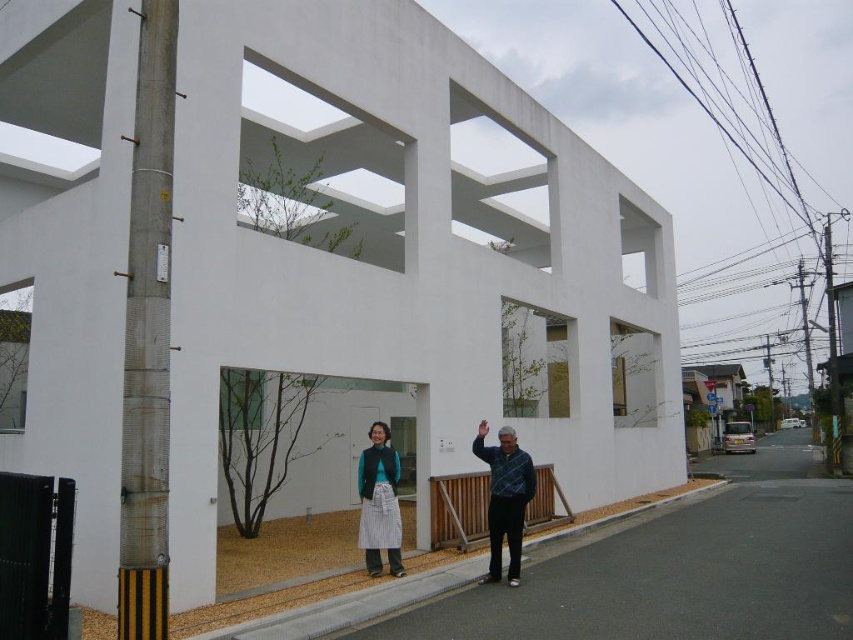
Question: Can you confirm if blue plaid shirt at lower right is smaller than striped fabric skirt at center?

Choices:
 (A) yes
 (B) no

Answer: (B)

Question: Is blue plaid shirt at lower right below striped fabric skirt at center?

Choices:
 (A) no
 (B) yes

Answer: (A)

Question: Is blue plaid shirt at lower right further to the viewer compared to striped fabric skirt at center?

Choices:
 (A) no
 (B) yes

Answer: (A)